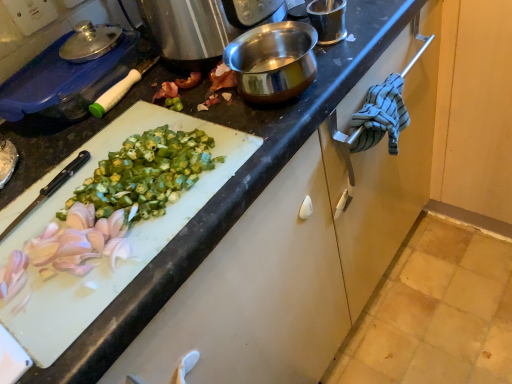
Question: Is blue plastic container at upper left outside white glossy cutting board at center-left?

Choices:
 (A) yes
 (B) no

Answer: (A)

Question: Is blue plastic container at upper left with white glossy cutting board at center-left?

Choices:
 (A) yes
 (B) no

Answer: (B)

Question: From a real-world perspective, is blue plastic container at upper left over white glossy cutting board at center-left?

Choices:
 (A) no
 (B) yes

Answer: (B)

Question: Does blue plastic container at upper left have a lesser height compared to white glossy cutting board at center-left?

Choices:
 (A) yes
 (B) no

Answer: (A)

Question: From the image's perspective, is blue plastic container at upper left located beneath white glossy cutting board at center-left?

Choices:
 (A) no
 (B) yes

Answer: (A)

Question: Can you confirm if blue plastic container at upper left is bigger than white glossy cutting board at center-left?

Choices:
 (A) no
 (B) yes

Answer: (A)

Question: Is blue plastic container at upper left located outside blue striped cloth at right?

Choices:
 (A) yes
 (B) no

Answer: (A)

Question: Considering the relative positions of blue plastic container at upper left and blue striped cloth at right in the image provided, is blue plastic container at upper left to the right of blue striped cloth at right from the viewer's perspective?

Choices:
 (A) no
 (B) yes

Answer: (A)

Question: Would you say blue striped cloth at right is part of blue plastic container at upper left's contents?

Choices:
 (A) no
 (B) yes

Answer: (A)

Question: Does blue plastic container at upper left lie behind blue striped cloth at right?

Choices:
 (A) no
 (B) yes

Answer: (A)

Question: From the image's perspective, is blue plastic container at upper left on blue striped cloth at right?

Choices:
 (A) no
 (B) yes

Answer: (B)

Question: Does blue plastic container at upper left have a lesser height compared to blue striped cloth at right?

Choices:
 (A) yes
 (B) no

Answer: (A)

Question: Is white glossy cutting board at center-left positioned with its back to blue plastic container at upper left?

Choices:
 (A) no
 (B) yes

Answer: (B)